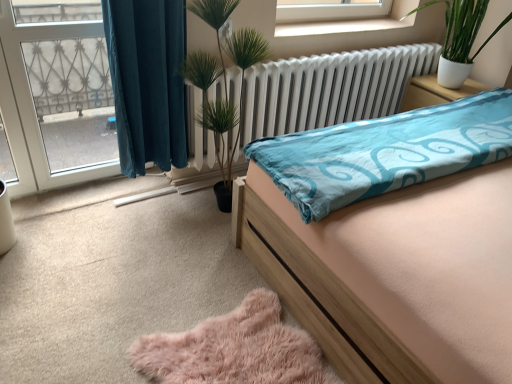
Where is `empty space that is ontop of fluffy pink rug at lower center (from a real-world perspective)`? empty space that is ontop of fluffy pink rug at lower center (from a real-world perspective) is located at coordinates (234, 349).